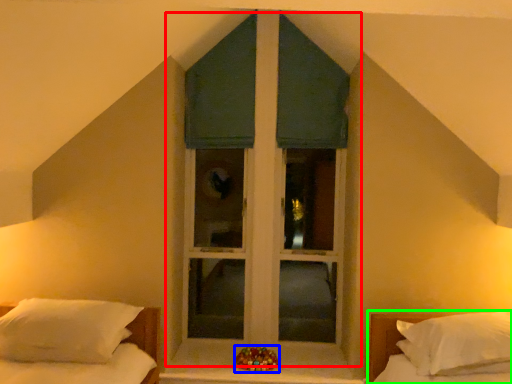
Question: Which object is the farthest from window (highlighted by a red box)? Choose among these: miniature (highlighted by a blue box) or bed (highlighted by a green box).

Choices:
 (A) miniature
 (B) bed

Answer: (B)